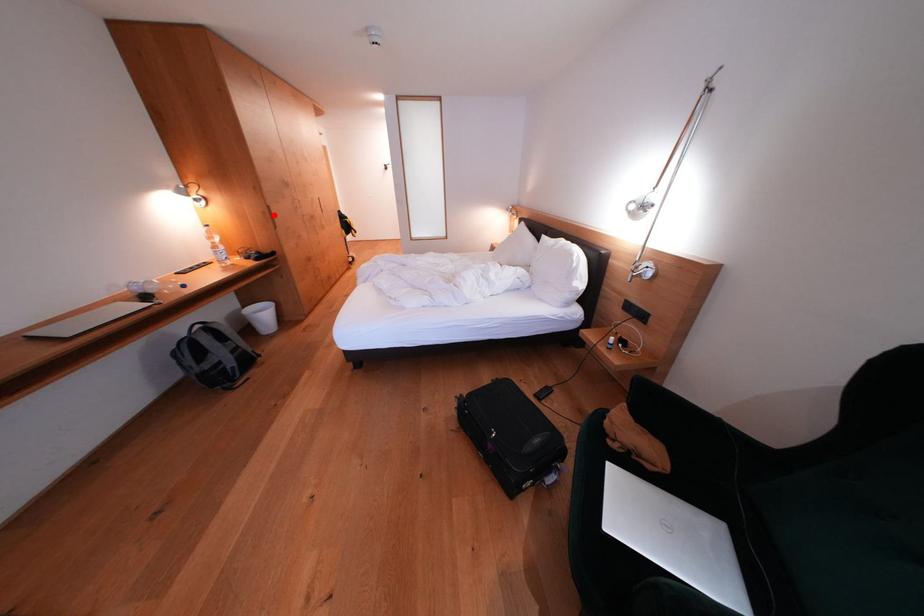
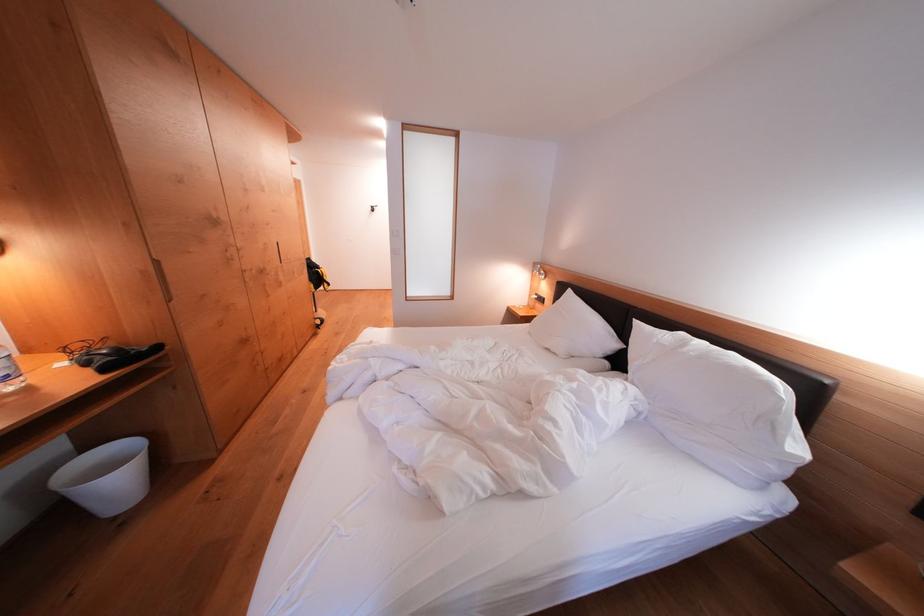
Question: A red point is marked in image1. In image2, is the corresponding 3D point closer to the camera or farther? Reply with the corresponding letter.

Choices:
 (A) The corresponding 3D point is closer.
 (B) The corresponding 3D point is farther.

Answer: (B)